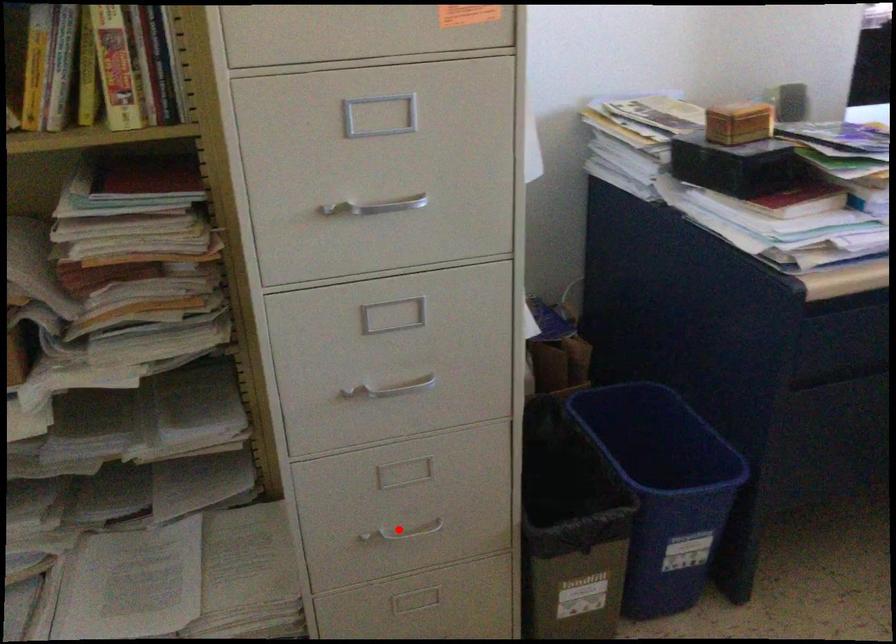
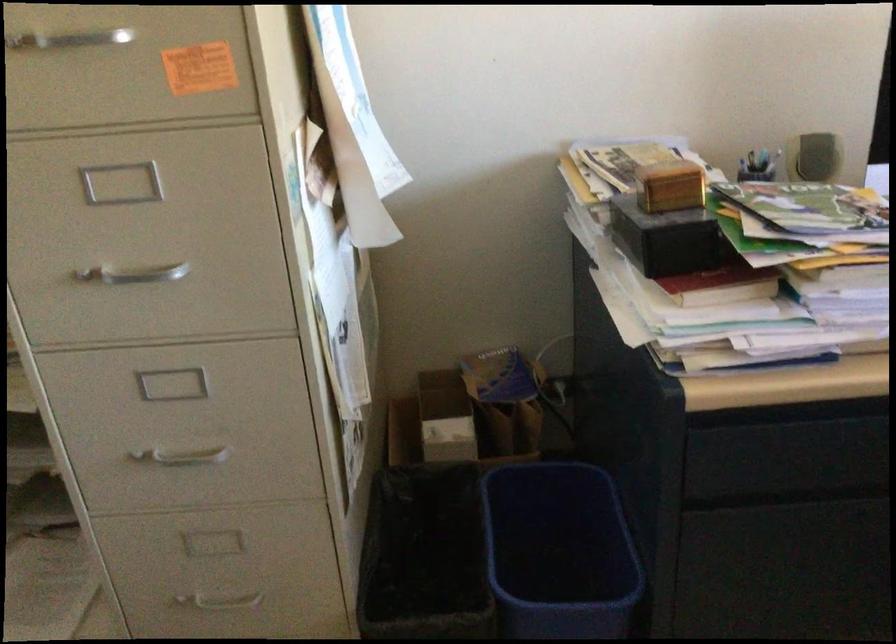
In the second image, find the point that corresponds to the highlighted location in the first image.

(216, 601)